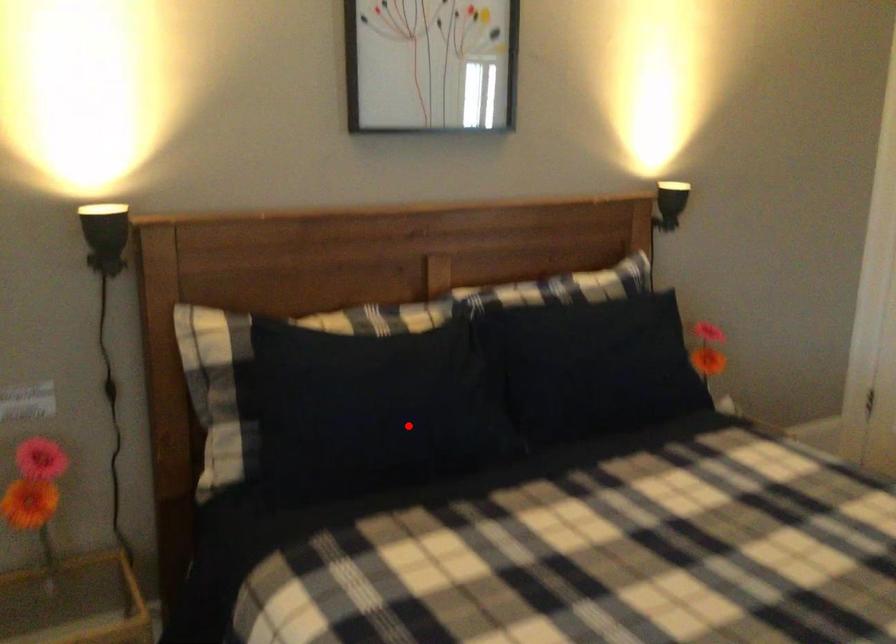
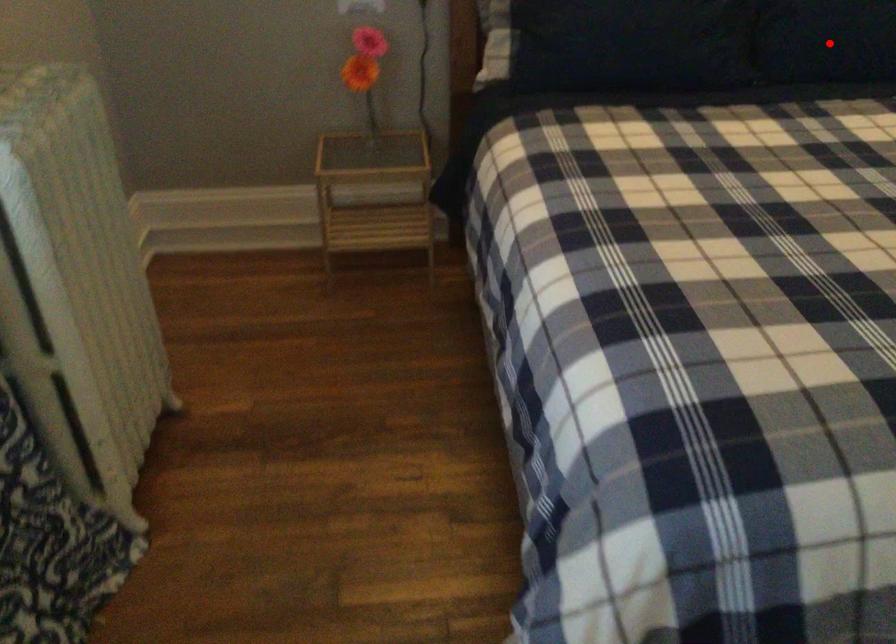
I am providing you with two images of the same scene from different viewpoints. A red point is marked on the first image and another point is marked on the second image. Is the red point in image1 aligned with the point shown in image2?

No